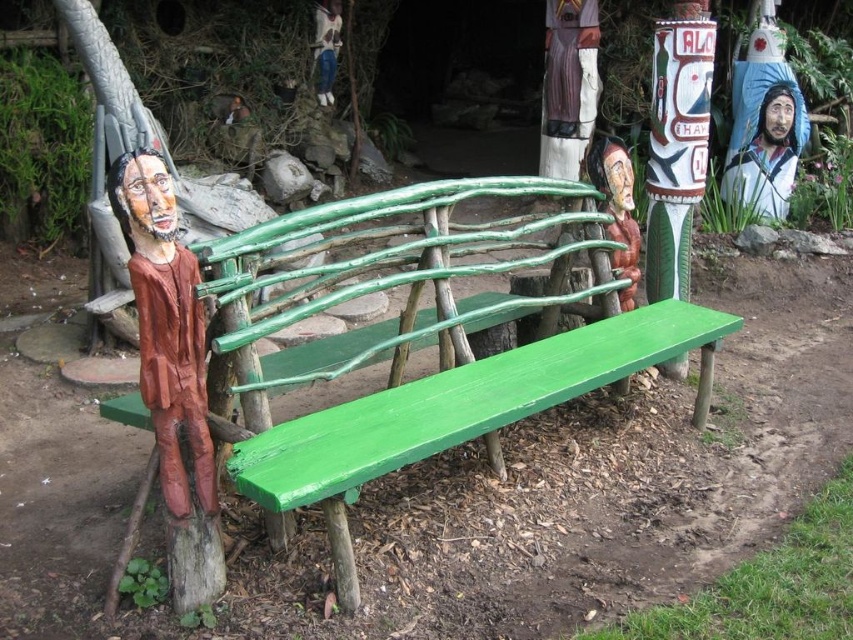
Question: Estimate the real-world distances between objects in this image. Which object is closer to the wooden totem pole at upper center?

Choices:
 (A) wooden figure at center
 (B) brushed metal figure at upper center

Answer: (A)

Question: Does wooden figure at left appear over brushed metal figure at upper center?

Choices:
 (A) yes
 (B) no

Answer: (B)

Question: Which point is farther to the camera?

Choices:
 (A) wooden figure at left
 (B) smooth painted wood statue at upper right
 (C) wooden totem pole at upper center
 (D) brushed metal figure at upper center

Answer: (D)

Question: Which point is farther from the camera taking this photo?

Choices:
 (A) pos(329,36)
 (B) pos(614,224)
 (C) pos(788,99)

Answer: (A)

Question: Does wooden figure at left have a smaller size compared to brushed metal figure at upper center?

Choices:
 (A) yes
 (B) no

Answer: (A)

Question: Is wooden totem pole at upper center smaller than brushed metal figure at upper center?

Choices:
 (A) no
 (B) yes

Answer: (A)